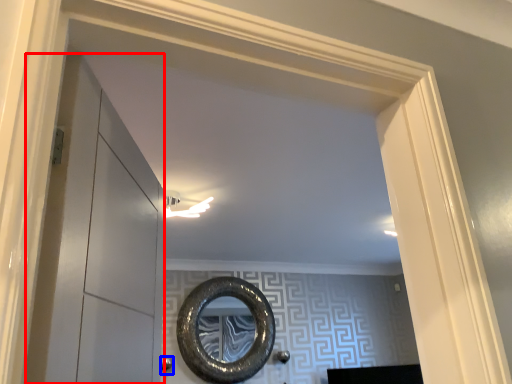
Question: Which of the following is the farthest to the observer, glass door (highlighted by a red box) or door handle (highlighted by a blue box)?

Choices:
 (A) glass door
 (B) door handle

Answer: (B)